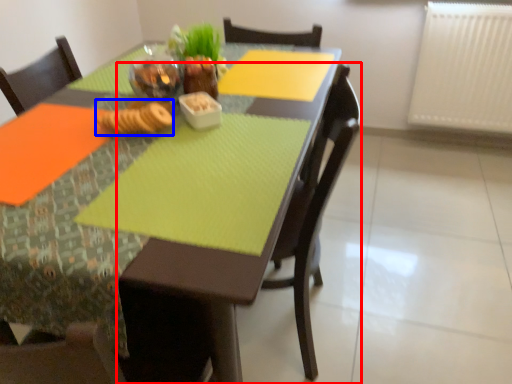
Question: Which object appears farthest to the camera in this image, chair (highlighted by a red box) or food (highlighted by a blue box)?

Choices:
 (A) chair
 (B) food

Answer: (B)